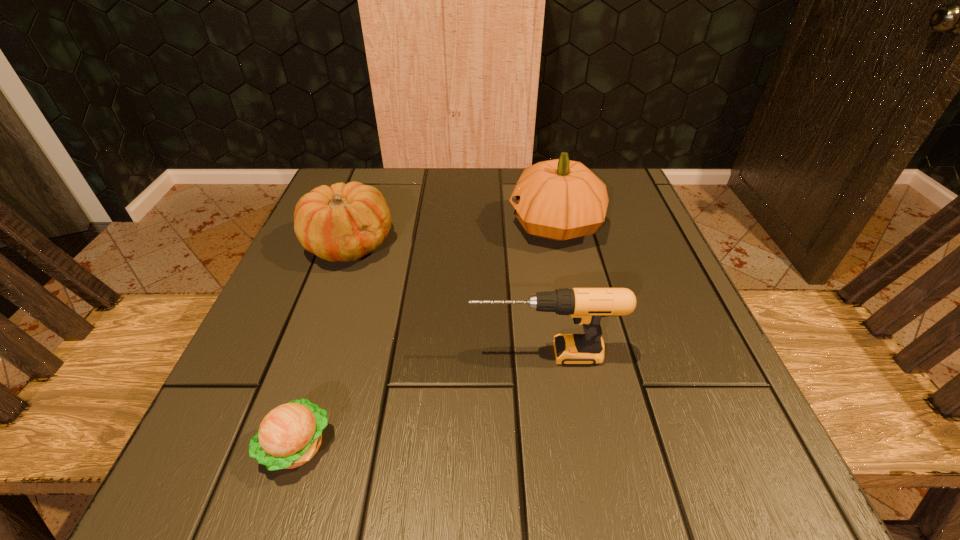
Where is `vacant space in between the taller gourd and the second shortest object`? The height and width of the screenshot is (540, 960). vacant space in between the taller gourd and the second shortest object is located at coordinates (452, 235).

Locate which object is the second closest to the shorter gourd. Please provide its 2D coordinates. Your answer should be formatted as a tuple, i.e. [(x, y)], where the tuple contains the x and y coordinates of a point satisfying the conditions above.

[(560, 199)]

Locate an element on the screen. The width and height of the screenshot is (960, 540). object that is the closest to the second shortest object is located at coordinates (586, 306).

Locate an element on the screen. free region that satisfies the following two spatial constraints: 1. on the handle side of the drill; 2. on the front side of the nearest object is located at coordinates (557, 446).

Find the location of a particular element. free spot that satisfies the following two spatial constraints: 1. on the side of the taller gourd with the carved face; 2. on the front side of the shortest object is located at coordinates (604, 446).

At what (x,y) coordinates should I click in order to perform the action: click on free spot that satisfies the following two spatial constraints: 1. on the side of the tallest object with the carved face; 2. on the front side of the shortest object. Please return your answer as a coordinate pair (x, y). The width and height of the screenshot is (960, 540). Looking at the image, I should click on click(604, 446).

The height and width of the screenshot is (540, 960). I want to click on blank space that satisfies the following two spatial constraints: 1. on the front side of the left gourd; 2. on the right side of the shortest object, so click(276, 446).